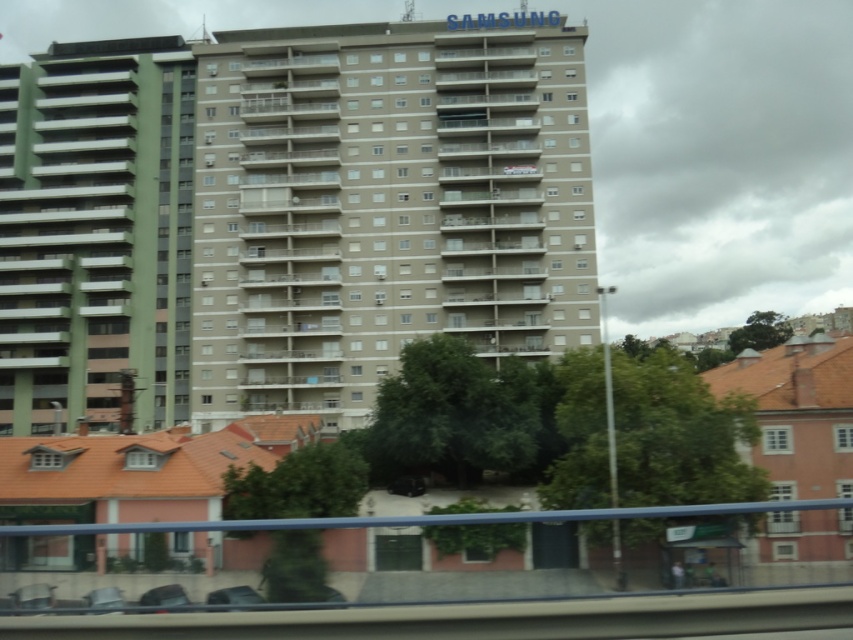
You are a delivery driver needing to park your metallic gray car at lower center near the green matte building at left. Based on the scene, can you park the car directly in front of the building?

The green matte building at left is above the metallic gray car at lower center, meaning the car is positioned lower in the scene. Since the building is elevated relative to the car, you can park the metallic gray car at lower center directly in front of the green matte building at left as they are aligned vertically.

You are a city planner analyzing this urban area. You need to determine if the green matte building at left can block sunlight from reaching the metallic gray car at lower center. Based on their heights, what is your conclusion?

The green matte building at left is much taller than the metallic gray car at lower center, so it is possible that the building could block sunlight from reaching the car depending on their positions and the sun angle.